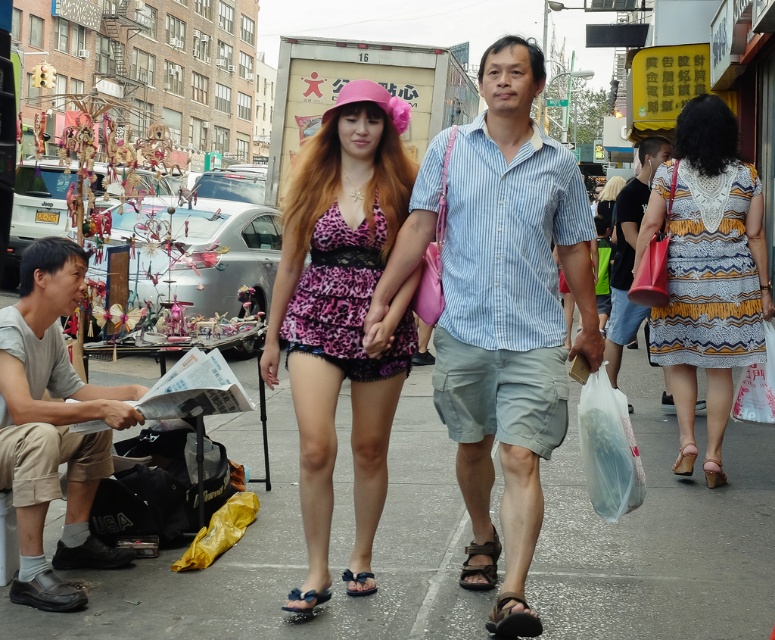
Question: From the image, what is the correct spatial relationship of printed fabric dress at center in relation to black leather sandal at lower center?

Choices:
 (A) above
 (B) below

Answer: (A)

Question: Which of the following is the closest to the observer?

Choices:
 (A) black rubber sandal at center
 (B) blue striped shirt at center

Answer: (B)

Question: Which object appears closest to the camera in this image?

Choices:
 (A) leather high-heeled sandal at lower right
 (B) blue striped shirt at center

Answer: (B)

Question: Does matte black shirt at center have a greater width compared to brown leather sandal at lower center?

Choices:
 (A) yes
 (B) no

Answer: (A)

Question: Estimate the real-world distances between objects in this image. Which object is farther from the light brown leather sandal at lower right?

Choices:
 (A) printed fabric dress at center
 (B) black suede sandal at center
 (C) brown leather sandal at lower center

Answer: (B)

Question: Can you confirm if black rubber sandal at center is positioned above leather high-heeled sandal at lower right?

Choices:
 (A) yes
 (B) no

Answer: (B)